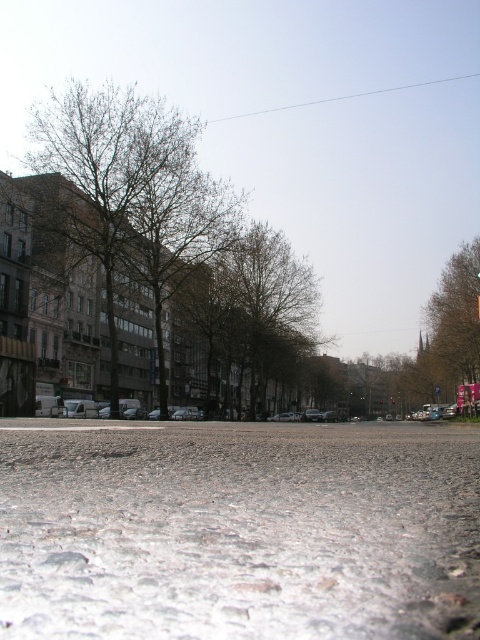
Question: Does white granular snow at center have a lesser width compared to brown leafy tree at right?

Choices:
 (A) yes
 (B) no

Answer: (B)

Question: Which object is farther from the camera taking this photo?

Choices:
 (A) brown leafy tree at right
 (B) brown leafless tree at left
 (C) white granular snow at center

Answer: (A)

Question: Which point is farther from the camera taking this photo?

Choices:
 (A) (80, 90)
 (B) (255, 429)

Answer: (A)

Question: Can you confirm if white granular snow at center is positioned to the left of brown leafless tree at left?

Choices:
 (A) no
 (B) yes

Answer: (A)

Question: Which object is positioned closest to the brown leafy tree at right?

Choices:
 (A) brown leafless tree at left
 (B) white granular snow at center

Answer: (A)

Question: Can you confirm if white granular snow at center is positioned below brown leafy tree at right?

Choices:
 (A) yes
 (B) no

Answer: (A)